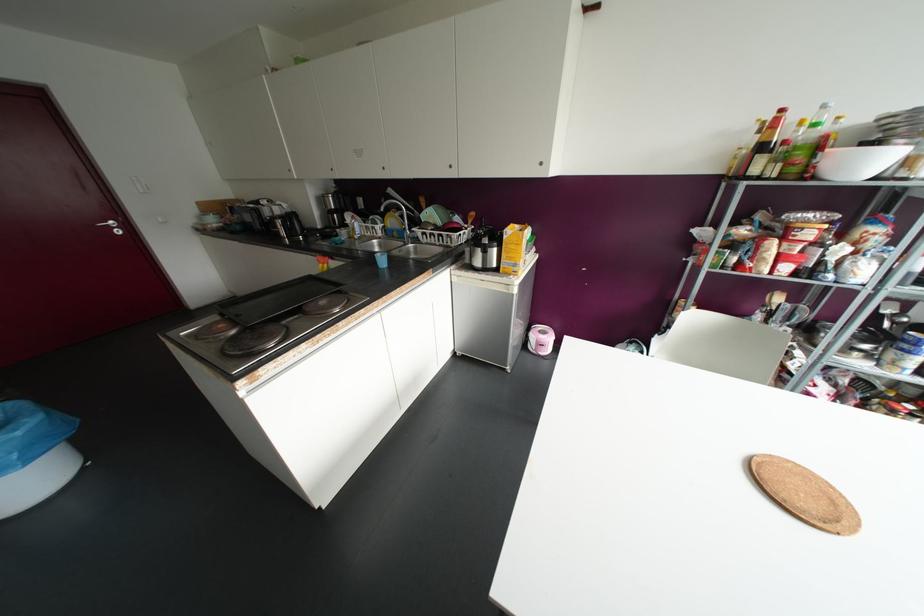
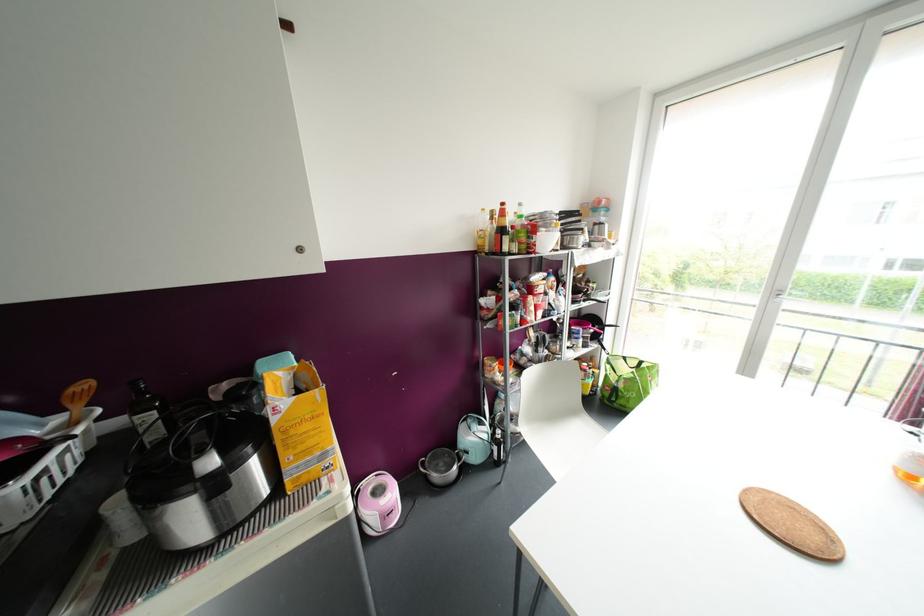
Question: How did the camera likely rotate?

Choices:
 (A) Left
 (B) Right
 (C) Up
 (D) Down

Answer: (B)